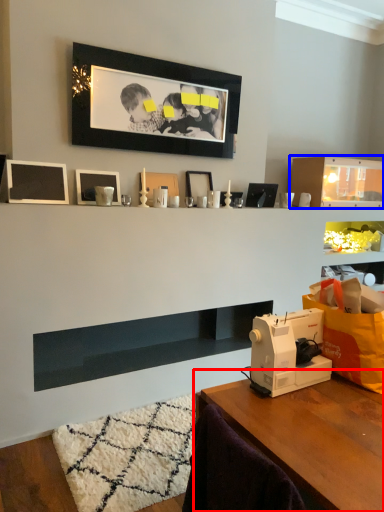
Question: Among these objects, which one is farthest to the camera, table (highlighted by a red box) or shelf (highlighted by a blue box)?

Choices:
 (A) table
 (B) shelf

Answer: (B)